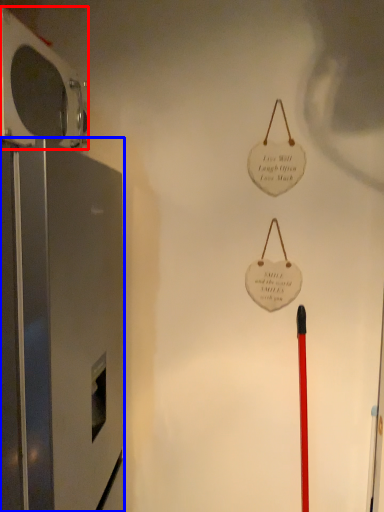
Question: Which of the following is the closest to the observer, appliance (highlighted by a red box) or appliance (highlighted by a blue box)?

Choices:
 (A) appliance
 (B) appliance

Answer: (B)